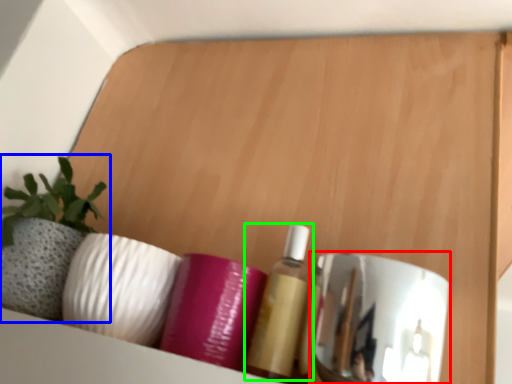
Question: Considering the real-world distances, which object is closest to mirror (highlighted by a red box)? houseplant (highlighted by a blue box) or toiletry (highlighted by a green box).

Choices:
 (A) houseplant
 (B) toiletry

Answer: (B)